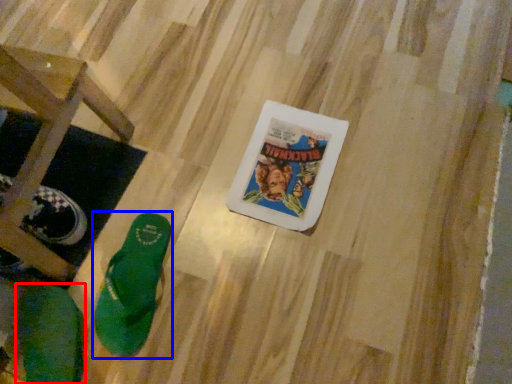
Question: Which object is closer to the camera taking this photo, footwear (highlighted by a red box) or footwear (highlighted by a blue box)?

Choices:
 (A) footwear
 (B) footwear

Answer: (A)